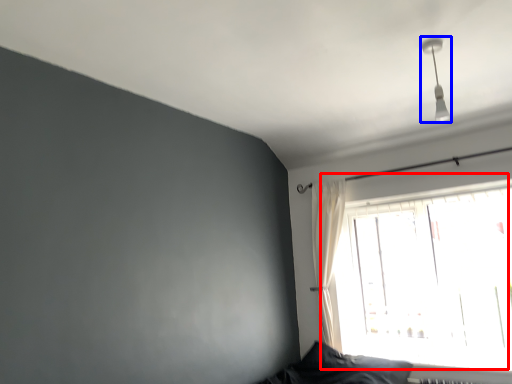
Question: Which point is further to the camera, window (highlighted by a red box) or fixture (highlighted by a blue box)?

Choices:
 (A) window
 (B) fixture

Answer: (A)